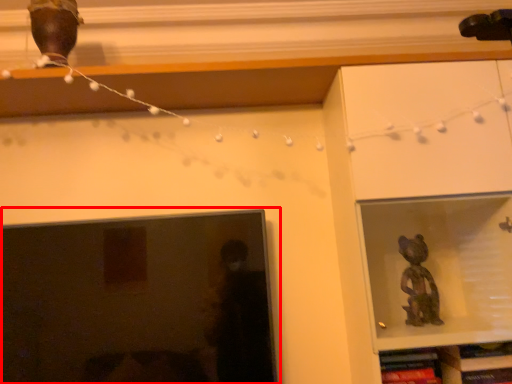
Question: From the image's perspective, where is picture frame (annotated by the red box) located relative to shelf?

Choices:
 (A) above
 (B) below

Answer: (A)